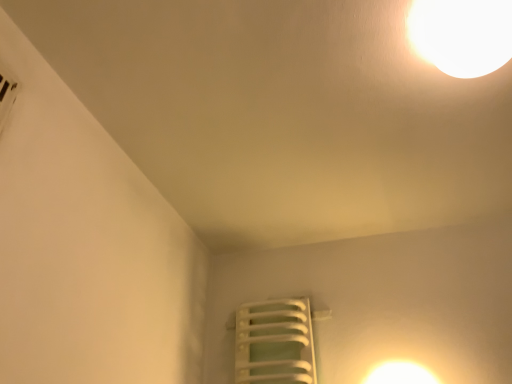
The width and height of the screenshot is (512, 384). What do you see at coordinates (462, 35) in the screenshot?
I see `white glossy lampshade at upper right` at bounding box center [462, 35].

Where is `white glossy light at upper right`? white glossy light at upper right is located at coordinates (400, 373).

The image size is (512, 384). What do you see at coordinates (400, 373) in the screenshot?
I see `white glossy light at upper right` at bounding box center [400, 373].

Measure the distance between white plastic radiator at lower center and camera.

The depth of white plastic radiator at lower center is 1.48 meters.

Locate an element on the screen. white glossy lampshade at upper right is located at coordinates (462, 35).

From a real-world perspective, who is located lower, white glossy lampshade at upper right or white glossy light at upper right?

white glossy light at upper right.

Which object is closer to the camera, white glossy lampshade at upper right or white glossy light at upper right?

white glossy lampshade at upper right.

Which is closer to the camera, (488, 13) or (386, 366)?

The point (488, 13) is closer to the camera.

Considering the relative sizes of white glossy lampshade at upper right and white glossy light at upper right in the image provided, is white glossy lampshade at upper right wider than white glossy light at upper right?

Indeed, white glossy lampshade at upper right has a greater width compared to white glossy light at upper right.

Find the location of a particular element. This screenshot has width=512, height=384. radiator below the white glossy lampshade at upper right (from a real-world perspective) is located at coordinates (274, 343).

Considering the positions of point (440, 14) and point (234, 328), is point (440, 14) closer or farther from the camera than point (234, 328)?

Point (440, 14).

Is the surface of white glossy lampshade at upper right in direct contact with white plastic radiator at lower center?

white glossy lampshade at upper right and white plastic radiator at lower center are not in contact.

Which of these two, white glossy lampshade at upper right or white plastic radiator at lower center, is bigger?

With larger size is white plastic radiator at lower center.

Which of these two, white glossy light at upper right or white plastic radiator at lower center, is wider?

white plastic radiator at lower center is wider.

Is white glossy light at upper right oriented away from white plastic radiator at lower center?

No, white plastic radiator at lower center is not at the back of white glossy light at upper right.

From the image's perspective, is white glossy light at upper right above or below white plastic radiator at lower center?

Clearly, from the image's perspective, white glossy light at upper right is below white plastic radiator at lower center.

How far apart are white glossy light at upper right and white plastic radiator at lower center?

The distance of white glossy light at upper right from white plastic radiator at lower center is 13.61 inches.

How distant is white glossy light at upper right from white glossy lampshade at upper right?

white glossy light at upper right is 1.06 meters away from white glossy lampshade at upper right.

Image resolution: width=512 pixels, height=384 pixels. In order to click on light below the white glossy lampshade at upper right (from the image's perspective) in this screenshot , I will do `click(400, 373)`.

Does white glossy light at upper right lie in front of white glossy lampshade at upper right?

No, it is not.

Which of these two, white plastic radiator at lower center or white glossy lampshade at upper right, is smaller?

Smaller between the two is white glossy lampshade at upper right.

Measure the distance between white plastic radiator at lower center and white glossy lampshade at upper right.

white plastic radiator at lower center and white glossy lampshade at upper right are 1.10 meters apart.

Looking at this image, are white plastic radiator at lower center and white glossy lampshade at upper right located far from each other?

white plastic radiator at lower center is far away from white glossy lampshade at upper right.

From a real-world perspective, is white plastic radiator at lower center on white glossy lampshade at upper right?

No, from a real-world perspective, white plastic radiator at lower center is not above white glossy lampshade at upper right.

In the scene shown: Considering the relative positions of white plastic radiator at lower center and white glossy light at upper right in the image provided, is white plastic radiator at lower center behind white glossy light at upper right?

Yes, it is behind white glossy light at upper right.

Between point (253, 320) and point (376, 376), which one is positioned behind?

The point (253, 320) is farther from the camera.

In the scene shown: Which of these two, white plastic radiator at lower center or white glossy light at upper right, is smaller?

white glossy light at upper right.

Does white plastic radiator at lower center turn towards white glossy light at upper right?

No, white plastic radiator at lower center does not turn towards white glossy light at upper right.

Identify the location of lamp in front of the white glossy light at upper right. This screenshot has height=384, width=512. coord(462,35).

Where is `radiator below the white glossy lampshade at upper right (from a real-world perspective)`? The width and height of the screenshot is (512, 384). radiator below the white glossy lampshade at upper right (from a real-world perspective) is located at coordinates (274, 343).

Estimate the real-world distances between objects in this image. Which object is further from white plastic radiator at lower center, white glossy light at upper right or white glossy lampshade at upper right?

white glossy lampshade at upper right.

Looking at the image, which one is located closer to white glossy lampshade at upper right, white plastic radiator at lower center or white glossy light at upper right?

The object closer to white glossy lampshade at upper right is white glossy light at upper right.

When comparing their distances from white glossy light at upper right, does white plastic radiator at lower center or white glossy lampshade at upper right seem further?

white glossy lampshade at upper right is positioned further to the anchor white glossy light at upper right.

Estimate the real-world distances between objects in this image. Which object is closer to white glossy light at upper right, white glossy lampshade at upper right or white plastic radiator at lower center?

white plastic radiator at lower center.

Considering their positions, is white glossy lampshade at upper right positioned closer to white plastic radiator at lower center than white glossy light at upper right?

white glossy light at upper right lies closer to white plastic radiator at lower center than the other object.

Estimate the real-world distances between objects in this image. Which object is closer to white glossy lampshade at upper right, white glossy light at upper right or white plastic radiator at lower center?

Among the two, white glossy light at upper right is located nearer to white glossy lampshade at upper right.

At what (x,y) coordinates should I click in order to perform the action: click on radiator between white glossy lampshade at upper right and white glossy light at upper right in the up-down direction. Please return your answer as a coordinate pair (x, y). This screenshot has height=384, width=512. Looking at the image, I should click on (274, 343).